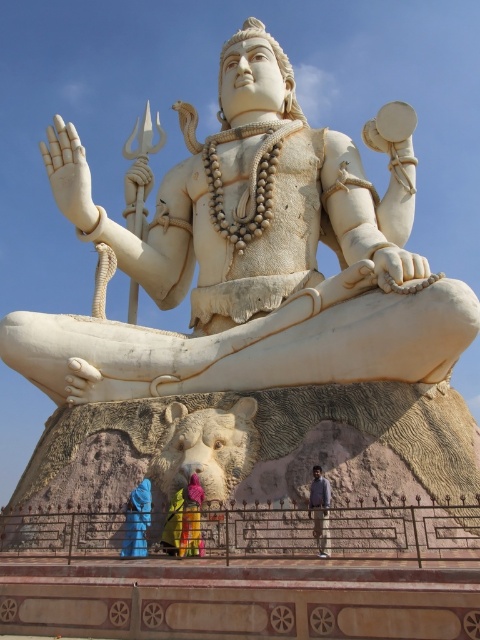
You are standing in front of the statue and want to place a small offering at the base. The statue has a base with a carved bear. Where should you place the offering relative to the light brown pants at lower center?

The offering should be placed at the base of the statue, which is located below the light brown pants at lower center. Since the pants are at point (320, 509), the base would be positioned lower than this coordinate.

You are standing in front of the statue and want to touch both points on it. Which point should you reach for first, the point at coordinate (63,401) or the point at coordinate (146,515)?

You should reach for the point at coordinate (63,401) first because it is closer to you than the point at coordinate (146,515).

You are an art restorer examining the statue. You notice the light brown pants at lower center and the yellow fabric at center. Which object is positioned lower in the image?

The light brown pants at lower center is positioned lower than the yellow fabric at center.